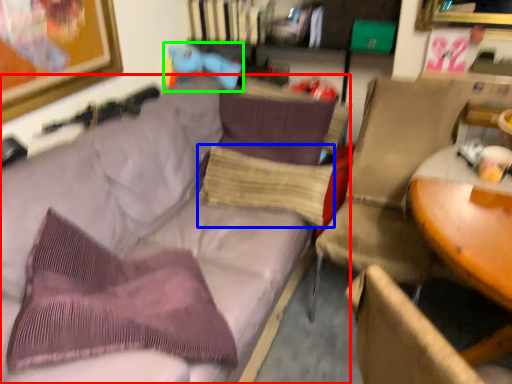
Question: Considering the real-world distances, which object is farthest from studio couch (highlighted by a red box)? pillow (highlighted by a blue box) or toy (highlighted by a green box)?

Choices:
 (A) pillow
 (B) toy

Answer: (B)